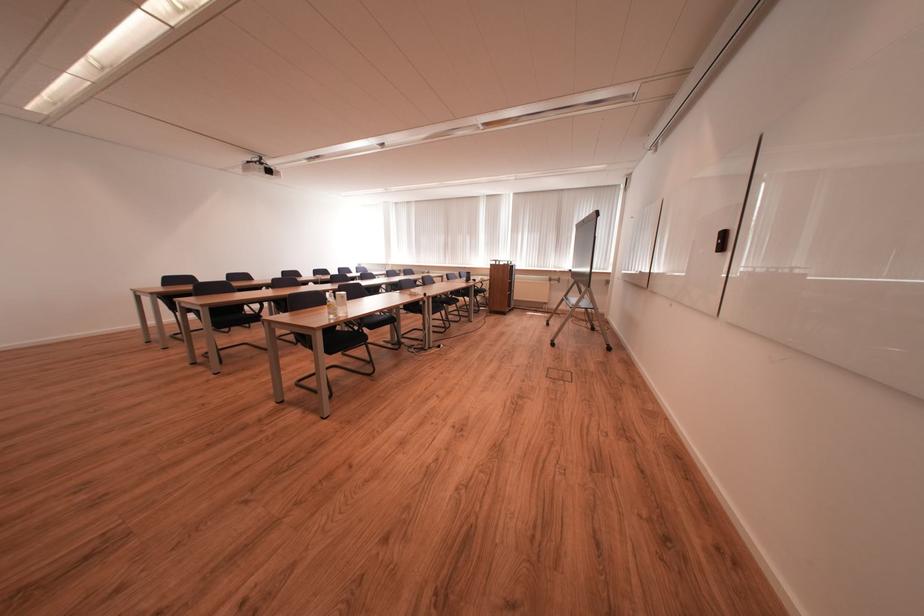
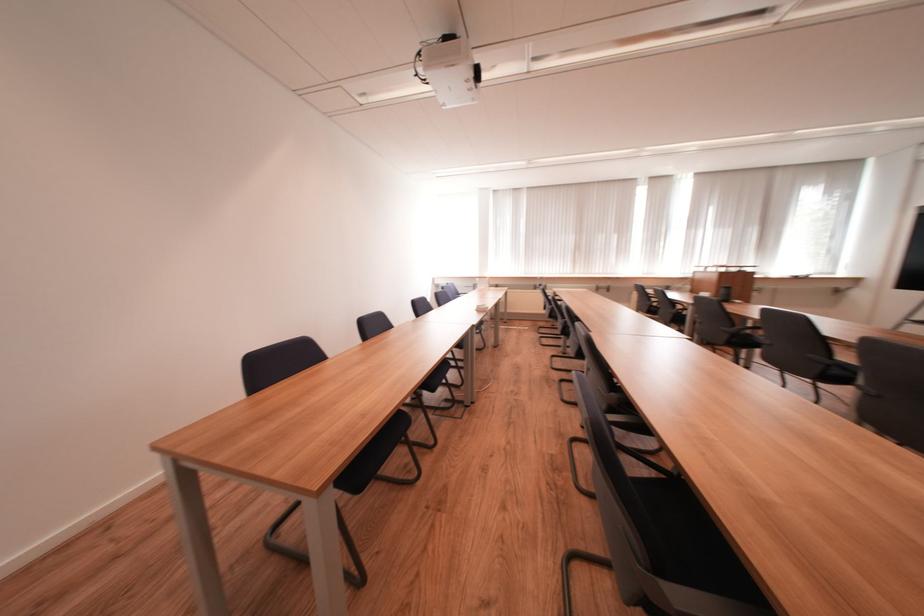
Where in the second image is the point corresponding to (x=277, y=174) from the first image?

(485, 75)